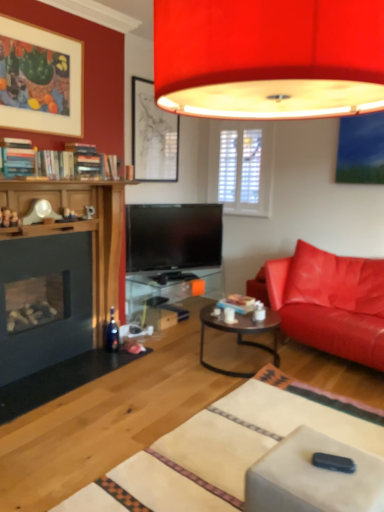
Question: Considering the relative sizes of matte black picture frame at upper center, the 1th picture frame from the right, and matte white picture frame at upper left, placed as the second picture frame when sorted from right to left, in the image provided, is matte black picture frame at upper center, the 1th picture frame from the right, bigger than matte white picture frame at upper left, placed as the second picture frame when sorted from right to left,?

Choices:
 (A) no
 (B) yes

Answer: (B)

Question: From a real-world perspective, does matte black picture frame at upper center, the 1th picture frame from the right, stand above matte white picture frame at upper left, the 1th picture frame when ordered from front to back?

Choices:
 (A) yes
 (B) no

Answer: (B)

Question: Is matte black picture frame at upper center, the 1th picture frame from the right, shorter than matte white picture frame at upper left, the 2th picture frame in the back-to-front sequence?

Choices:
 (A) yes
 (B) no

Answer: (B)

Question: Can we say matte black picture frame at upper center, marked as the first picture frame in a back-to-front arrangement, lies outside matte white picture frame at upper left, the 1th picture frame when ordered from front to back?

Choices:
 (A) no
 (B) yes

Answer: (B)

Question: Is the depth of matte black picture frame at upper center, the 2th picture frame when ordered from front to back, less than that of matte white picture frame at upper left, the 1th picture frame when ordered from front to back?

Choices:
 (A) yes
 (B) no

Answer: (B)

Question: From the image's perspective, is leather couch at right positioned above or below matte black picture frame at upper center, marked as the first picture frame in a back-to-front arrangement?

Choices:
 (A) above
 (B) below

Answer: (B)

Question: From their relative heights in the image, would you say leather couch at right is taller or shorter than matte black picture frame at upper center, the second picture frame positioned from the left?

Choices:
 (A) tall
 (B) short

Answer: (B)

Question: Is leather couch at right bigger or smaller than matte black picture frame at upper center, the 2th picture frame when ordered from front to back?

Choices:
 (A) small
 (B) big

Answer: (B)

Question: In terms of width, does leather couch at right look wider or thinner when compared to matte black picture frame at upper center, the 1th picture frame from the right?

Choices:
 (A) thin
 (B) wide

Answer: (B)

Question: From their relative heights in the image, would you say transparent glass table at center is taller or shorter than matte red lampshade at upper center?

Choices:
 (A) tall
 (B) short

Answer: (B)

Question: In the image, is transparent glass table at center positioned in front of or behind matte red lampshade at upper center?

Choices:
 (A) front
 (B) behind

Answer: (B)

Question: Would you say transparent glass table at center is inside or outside matte red lampshade at upper center?

Choices:
 (A) outside
 (B) inside

Answer: (A)

Question: Would you say transparent glass table at center is to the left or to the right of matte red lampshade at upper center in the picture?

Choices:
 (A) left
 (B) right

Answer: (A)

Question: From a real-world perspective, is matte red lampshade at upper center above or below matte black coffee table at center?

Choices:
 (A) above
 (B) below

Answer: (A)

Question: Looking at the image, does matte red lampshade at upper center seem bigger or smaller compared to matte black coffee table at center?

Choices:
 (A) small
 (B) big

Answer: (B)